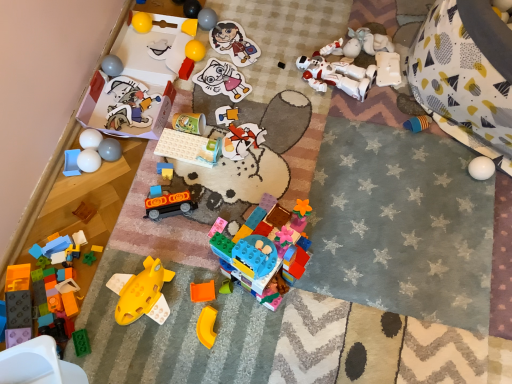
At what (x,y) coordinates should I click in order to perform the action: click on free space to the right of translucent orange plastic at center, the fifth toy in the right-to-left sequence. Please return your answer as a coordinate pair (x, y). Looking at the image, I should click on (287, 308).